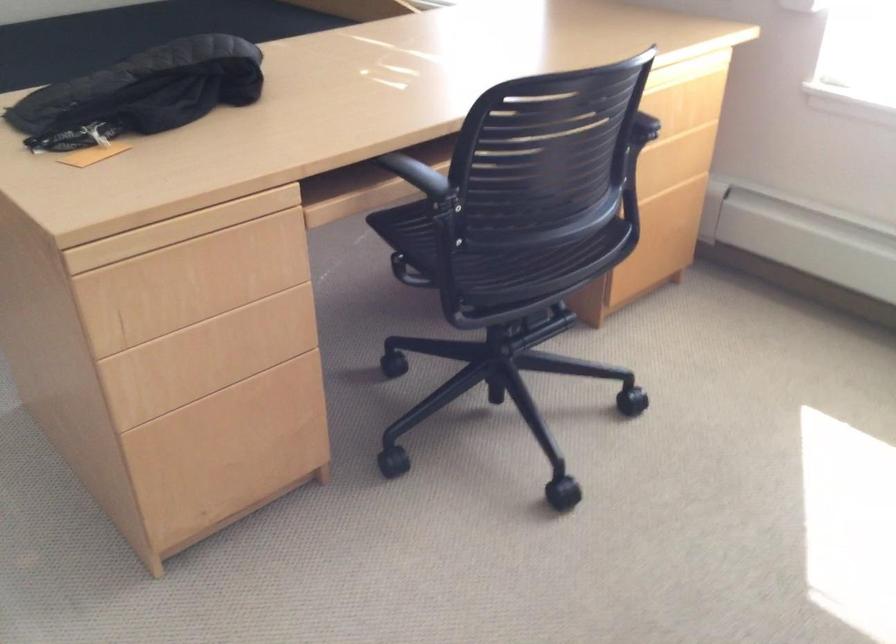
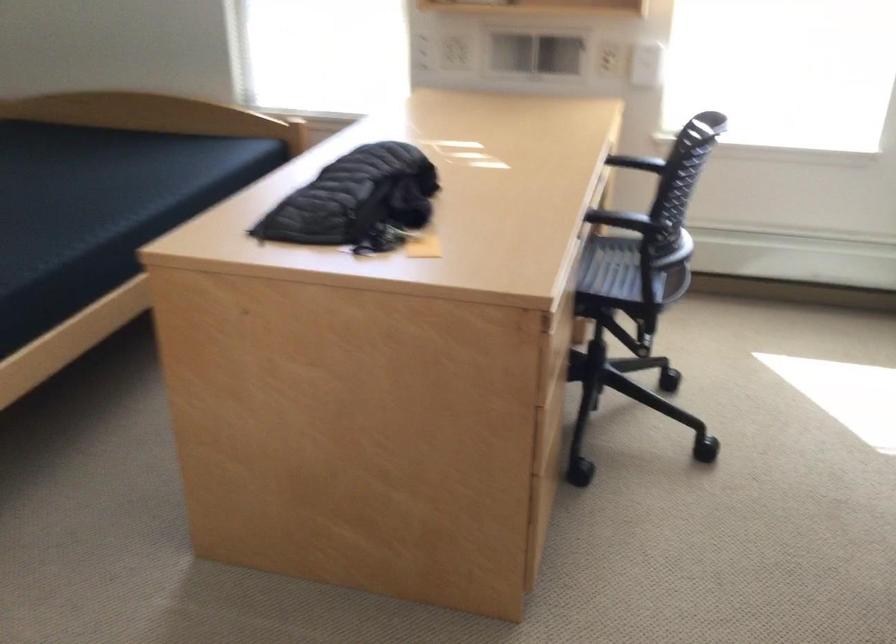
The point at (107, 155) is marked in the first image. Where is the corresponding point in the second image?

(421, 245)